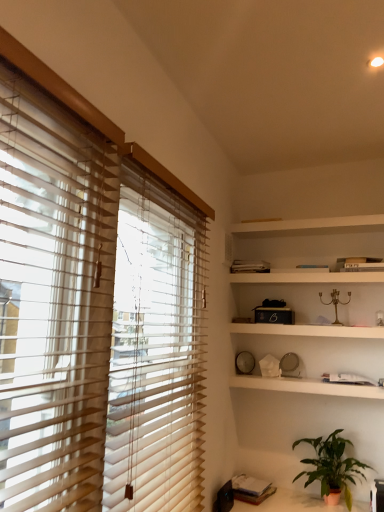
Question: In the image, is white matte book at upper center, the second book positioned from the front, on the left side or the right side of white matte clock at center, the 4th shelf viewed from the top?

Choices:
 (A) left
 (B) right

Answer: (A)

Question: From a real-world perspective, is white matte book at upper center, acting as the 1th book starting from the top, physically located above or below white matte clock at center, the 4th shelf viewed from the top?

Choices:
 (A) below
 (B) above

Answer: (B)

Question: Which is farther from the white matte book at upper center, acting as the 1th book starting from the top?

Choices:
 (A) matte black table at lower right
 (B) matte black book at lower right, which is the 1th book from front to back
 (C) green matte plant at lower right
 (D) white matte clock at center, the 4th shelf viewed from the top
 (E) beige wood blinds at left

Answer: (E)

Question: Estimate the real-world distances between objects in this image. Which object is closer to the green matte plant at lower right?

Choices:
 (A) white matte clock at center, which is the 1th shelf from bottom to top
 (B) matte black book at lower right, positioned as the second book in back-to-front order
 (C) beige wood blinds at left
 (D) white matte bookshelf at upper center, acting as the 3th shelf starting from the bottom
 (E) matte black table at lower right

Answer: (E)